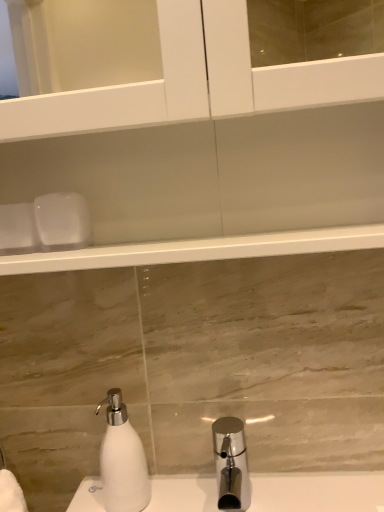
Question: From a real-world perspective, is white matte soap dispenser at lower left over chrome metallic tap at lower center?

Choices:
 (A) no
 (B) yes

Answer: (B)

Question: Could you tell me if white matte soap dispenser at lower left is turned towards chrome metallic tap at lower center?

Choices:
 (A) yes
 (B) no

Answer: (B)

Question: From the image's perspective, is white matte soap dispenser at lower left on top of chrome metallic tap at lower center?

Choices:
 (A) yes
 (B) no

Answer: (A)

Question: From a real-world perspective, is white matte soap dispenser at lower left located beneath chrome metallic tap at lower center?

Choices:
 (A) no
 (B) yes

Answer: (A)

Question: Is white matte soap dispenser at lower left to the left of chrome metallic tap at lower center from the viewer's perspective?

Choices:
 (A) no
 (B) yes

Answer: (B)

Question: Is white matte soap dispenser at lower left shorter than chrome metallic tap at lower center?

Choices:
 (A) no
 (B) yes

Answer: (A)

Question: Is chrome metallic tap at lower center next to white matte soap dispenser at lower left and touching it?

Choices:
 (A) yes
 (B) no

Answer: (B)

Question: Is chrome metallic tap at lower center behind white matte soap dispenser at lower left?

Choices:
 (A) yes
 (B) no

Answer: (B)

Question: Does chrome metallic tap at lower center come in front of white matte soap dispenser at lower left?

Choices:
 (A) no
 (B) yes

Answer: (B)

Question: From a real-world perspective, is chrome metallic tap at lower center physically below white matte soap dispenser at lower left?

Choices:
 (A) no
 (B) yes

Answer: (B)

Question: Is chrome metallic tap at lower center completely or partially outside of white matte soap dispenser at lower left?

Choices:
 (A) no
 (B) yes

Answer: (B)

Question: Is chrome metallic tap at lower center at the left side of white matte soap dispenser at lower left?

Choices:
 (A) no
 (B) yes

Answer: (A)

Question: Considering their positions, is chrome metallic tap at lower center located in front of or behind white matte soap dispenser at lower left?

Choices:
 (A) behind
 (B) front

Answer: (B)